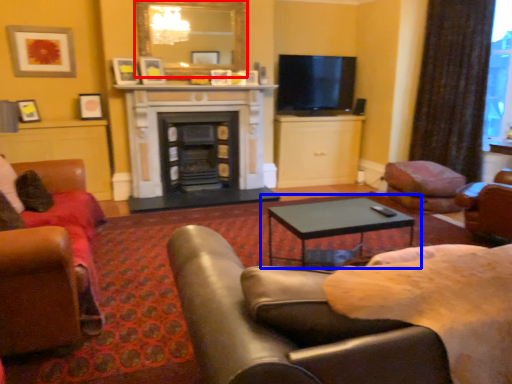
Question: Which object appears closest to the camera in this image, mirror (highlighted by a red box) or coffee table (highlighted by a blue box)?

Choices:
 (A) mirror
 (B) coffee table

Answer: (B)